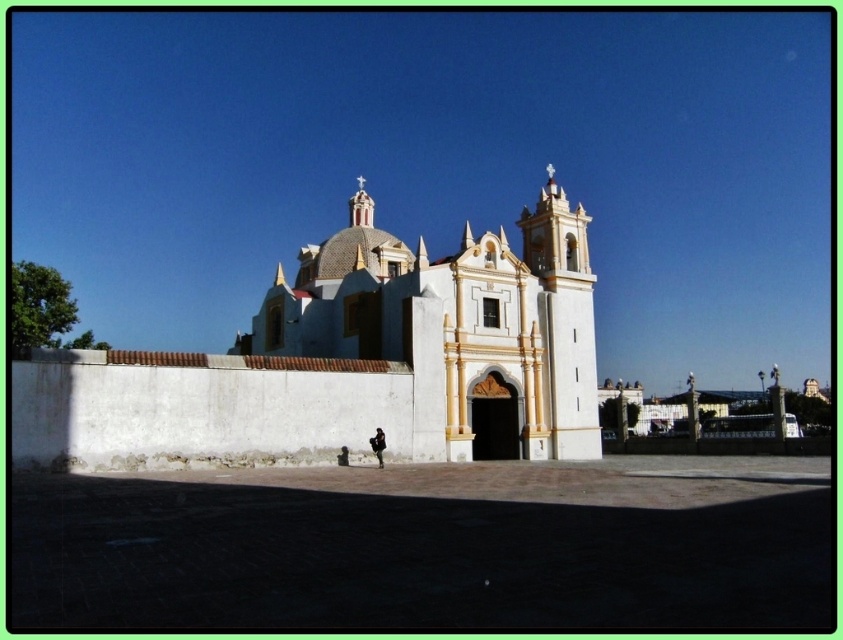
You are standing in front of the church and want to take a photo. There are two points marked on the structure you want to include in your shot. The first point is at coordinate point(262, 336) and the second is at point(380, 432). Which point is closer to your camera?

Point(262, 336) is closer to the camera than point(380, 432) because it is further to the camera than the other point.